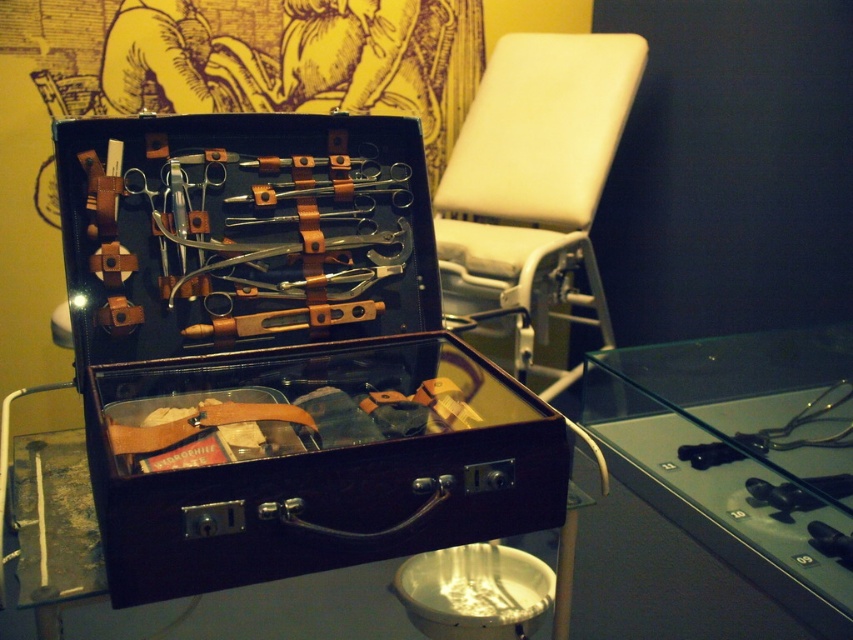
Question: Which object appears farthest from the camera in this image?

Choices:
 (A) polished silver scissors at center
 (B) metallic silver scissors at center
 (C) transparent glass case at center
 (D) leather suitcase at center

Answer: (A)

Question: Which of the following is the farthest from the observer?

Choices:
 (A) black rubber gloves at lower right
 (B) polished silver scissors at center

Answer: (B)

Question: Which of the following is the closest to the observer?

Choices:
 (A) (712, 444)
 (B) (67, 184)
 (C) (413, 244)

Answer: (B)

Question: Can you confirm if leather suitcase at center is positioned to the right of transparent glass case at center?

Choices:
 (A) yes
 (B) no

Answer: (B)

Question: Does polished silver scissors at center have a larger size compared to metallic silver scissors at center?

Choices:
 (A) no
 (B) yes

Answer: (B)

Question: Can you confirm if transparent glass case at center is positioned above black rubber gloves at lower right?

Choices:
 (A) yes
 (B) no

Answer: (A)